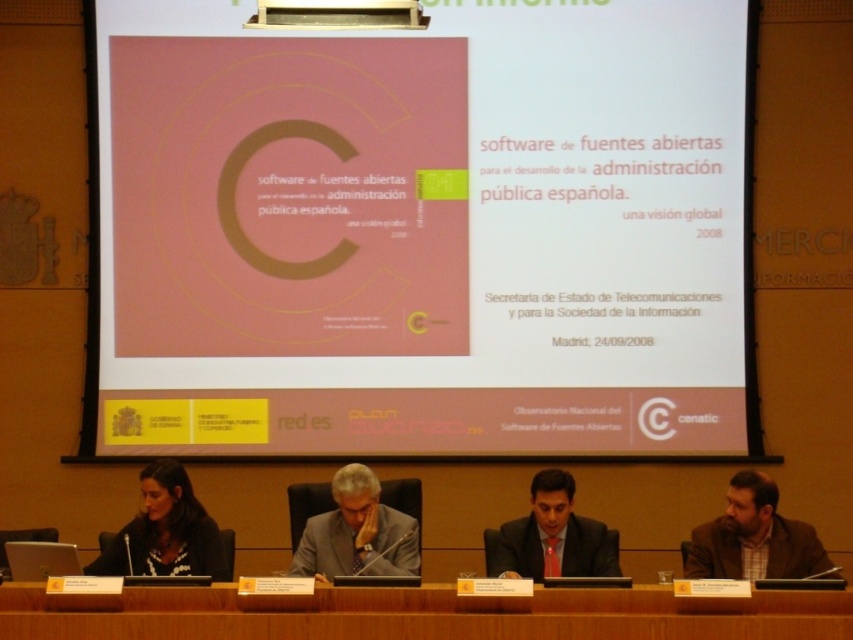
You are a photographer adjusting your camera to focus on the two points in the image. Which point, point (178, 566) or point (273, 20), is closer to the camera?

Point (178, 566) is closer to the camera than point (273, 20).

You are an attendee at this conference and want to take a photo of the pink matte poster at upper center. Where should you position yourself to capture it in the frame?

You should position yourself facing the pink matte poster at upper center, which is located at point (422, 230), to capture it in the frame.

You are organizing a conference and need to place a nameplate for a new speaker between the brown woolen jacket at lower right and the black fabric at lower left. Which side should the nameplate be placed closer to ensure it is visible to both attendees and the camera?

The nameplate should be placed closer to the brown woolen jacket at lower right since it is shorter than the black fabric at lower left, ensuring visibility over both objects.